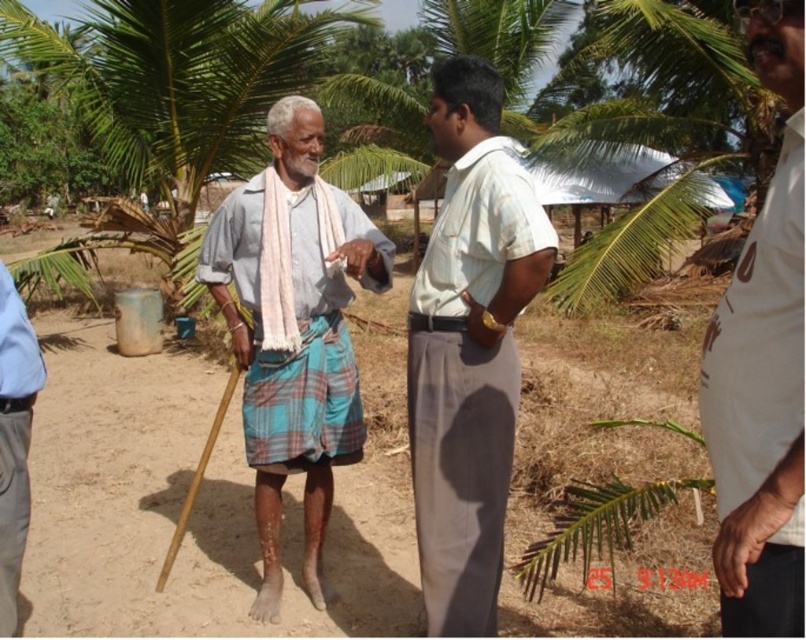
You are standing at the origin of a coordinate system in the center of this image. There is a point marked at coordinate (293, 330). What object is located at that point?

The point at coordinate (293, 330) marks the location of the light blue plaid cloth at center.

You are a photographer trying to capture a photo of the two men in the scene. You want to ensure that both the light blue plaid cloth at center and the white dotted shirt at center are visible in the frame. Based on their positions, which object should you focus on first to ensure both are in the shot?

Result: The light blue plaid cloth at center is to the left of the white dotted shirt at center, so focusing on the light blue plaid cloth at center first would ensure both objects are included in the frame since it is positioned to the left of the other.